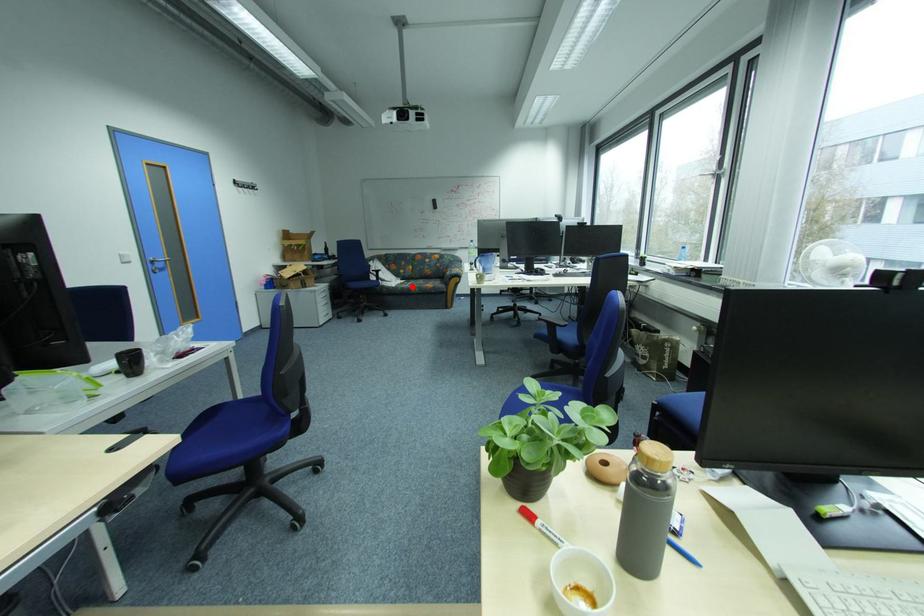
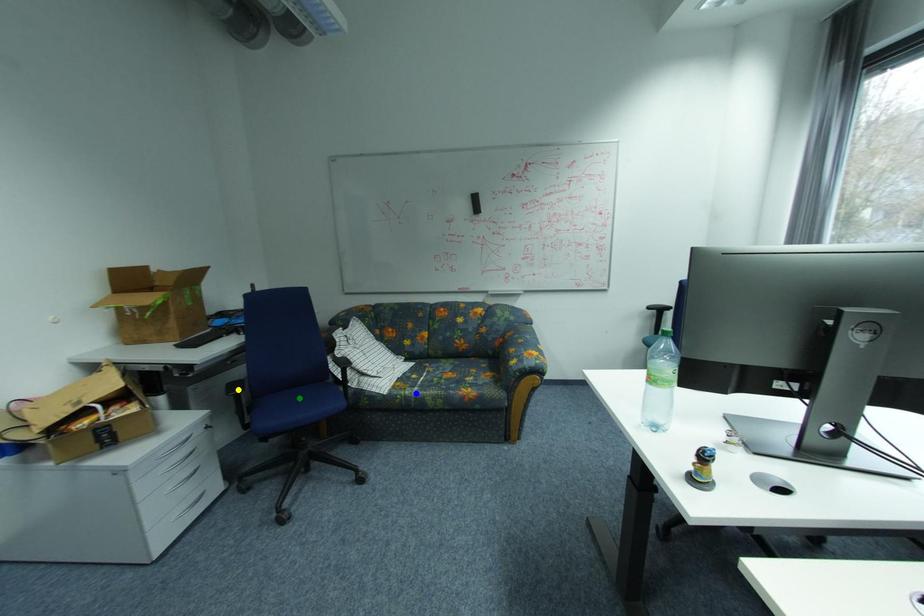
Question: I am providing you with two images of the same scene from different viewpoints. A red point is marked on the first image. You are given multiple points on the second image. In image 2, which mark is for the same physical point as the one in image 1?

Choices:
 (A) green point
 (B) yellow point
 (C) blue point

Answer: (C)